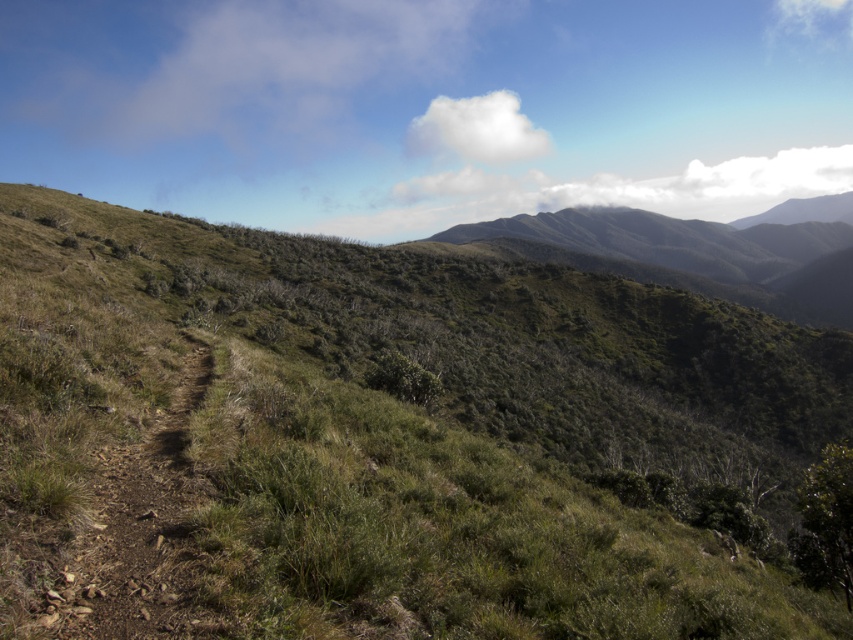
Does green grassy hillside at center have a lesser height compared to green grassy mountain at upper center?

Yes.

Which is behind, point (38, 241) or point (651, 256)?

The point (651, 256) is more distant.

Image resolution: width=853 pixels, height=640 pixels. Describe the element at coordinates (389, 440) in the screenshot. I see `green grassy hillside at center` at that location.

The height and width of the screenshot is (640, 853). What are the coordinates of `green grassy hillside at center` in the screenshot? It's located at (389, 440).